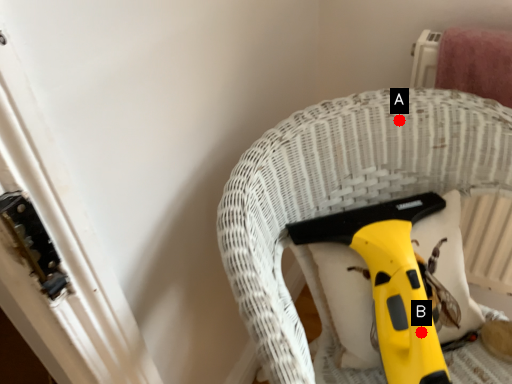
Question: Two points are circled on the image, labeled by A and B beside each circle. Which of the following is the closest to the observer?

Choices:
 (A) A is closer
 (B) B is closer

Answer: (B)